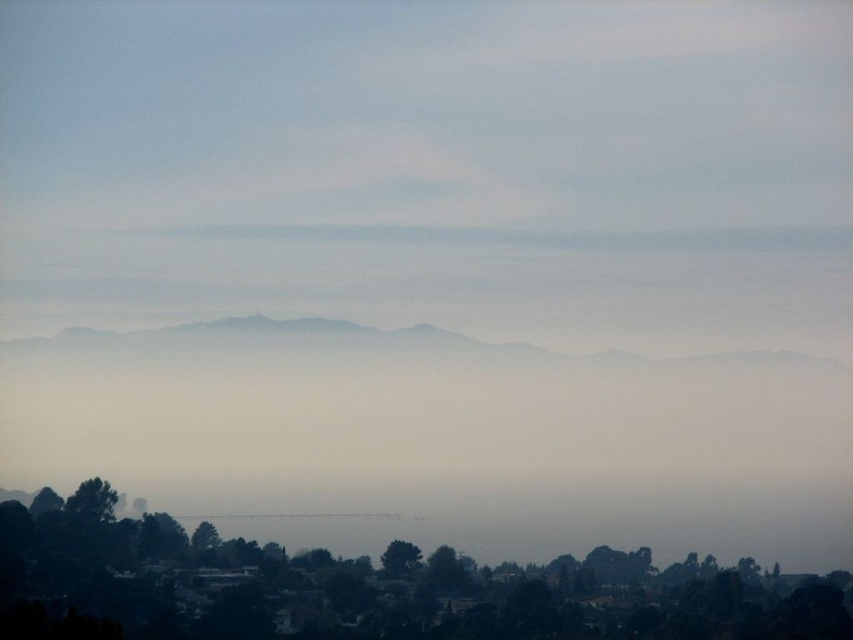
Does green matte tree at lower center have a smaller size compared to green matte tree at center?

No.

Is point (415, 616) more distant than point (399, 540)?

Yes, it is behind point (399, 540).

You are a GUI agent. You are given a task and a screenshot of the screen. Output one action in this format:
    pyautogui.click(x=<x>, y=<y>)
    Task: Click on the green matte tree at lower center
    
    Given the screenshot: What is the action you would take?
    pyautogui.click(x=368, y=588)